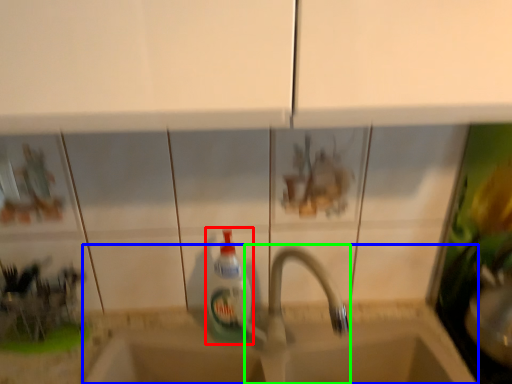
Question: Which object is positioned closest to bottle (highlighted by a red box)? Select from sink (highlighted by a blue box) and tap (highlighted by a green box).

Choices:
 (A) sink
 (B) tap

Answer: (B)